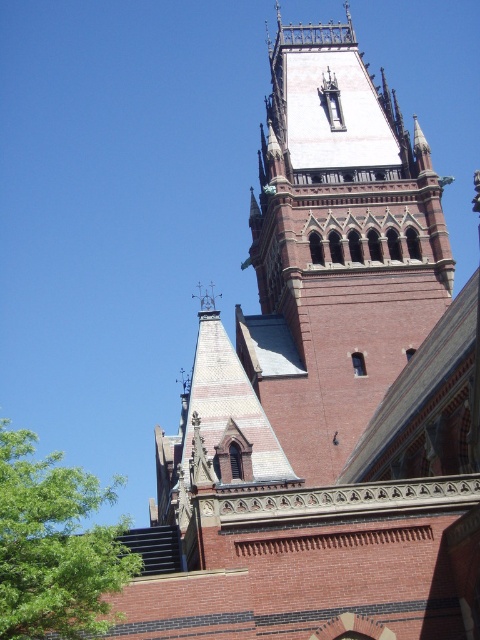
Question: Can you confirm if red brick bell tower at center is positioned above green leafy tree at lower left?

Choices:
 (A) yes
 (B) no

Answer: (A)

Question: Which of the following is the farthest from the observer?

Choices:
 (A) (381, 106)
 (B) (60, 472)

Answer: (A)

Question: Which point appears farthest from the camera in this image?

Choices:
 (A) click(52, 454)
 (B) click(288, 32)

Answer: (A)

Question: Can you confirm if red brick bell tower at center is positioned to the right of green leafy tree at lower left?

Choices:
 (A) yes
 (B) no

Answer: (A)

Question: Can you confirm if red brick bell tower at center is bigger than green leafy tree at lower left?

Choices:
 (A) no
 (B) yes

Answer: (A)